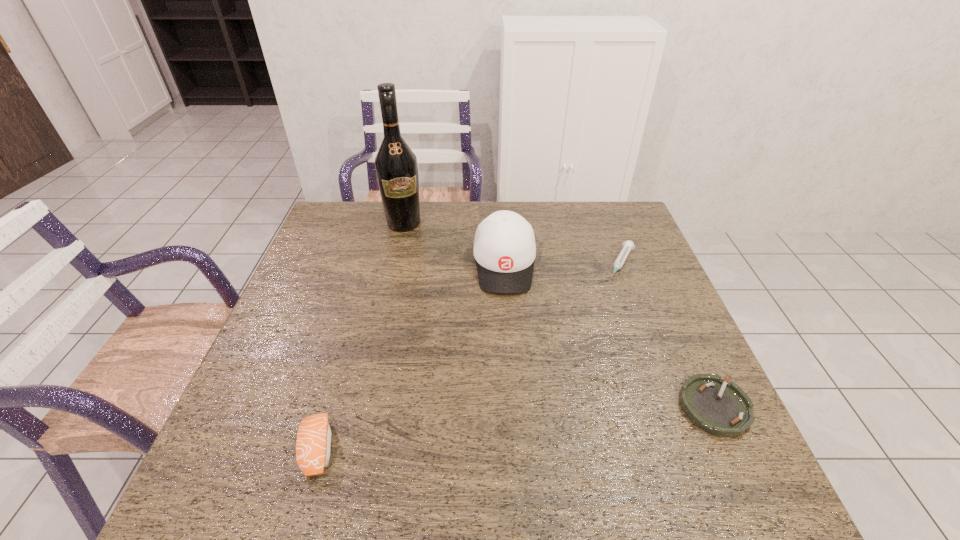
Locate an element on the screen. vacant space situated at the needle end of the syringe is located at coordinates (573, 367).

Identify the location of vacant point located at the needle end of the syringe. Image resolution: width=960 pixels, height=540 pixels. (599, 318).

You are a GUI agent. You are given a task and a screenshot of the screen. Output one action in this format:
    pyautogui.click(x=<x>, y=<y>)
    Task: Click on the vacant region located 0.190m on the front-facing side of the third object from right to left
    This screenshot has height=540, width=960.
    Given the screenshot: What is the action you would take?
    pyautogui.click(x=509, y=352)

Identify the location of vacant space located on the front-facing side of the third object from right to left. This screenshot has width=960, height=540. (507, 322).

Locate an element on the screen. vacant space positioned on the front-facing side of the third object from right to left is located at coordinates click(x=507, y=322).

Find the location of `vacant space situated 0.380m on the label of the tallest object`. vacant space situated 0.380m on the label of the tallest object is located at coordinates (435, 315).

In order to click on free spot located on the label of the tallest object in this screenshot , I will do `click(418, 264)`.

Where is `free space located on the label of the tallest object`? The width and height of the screenshot is (960, 540). free space located on the label of the tallest object is located at coordinates (425, 285).

The width and height of the screenshot is (960, 540). Identify the location of baseball cap located in the far edge section of the desktop. (504, 248).

The image size is (960, 540). I want to click on wine bottle that is positioned at the far edge, so click(396, 167).